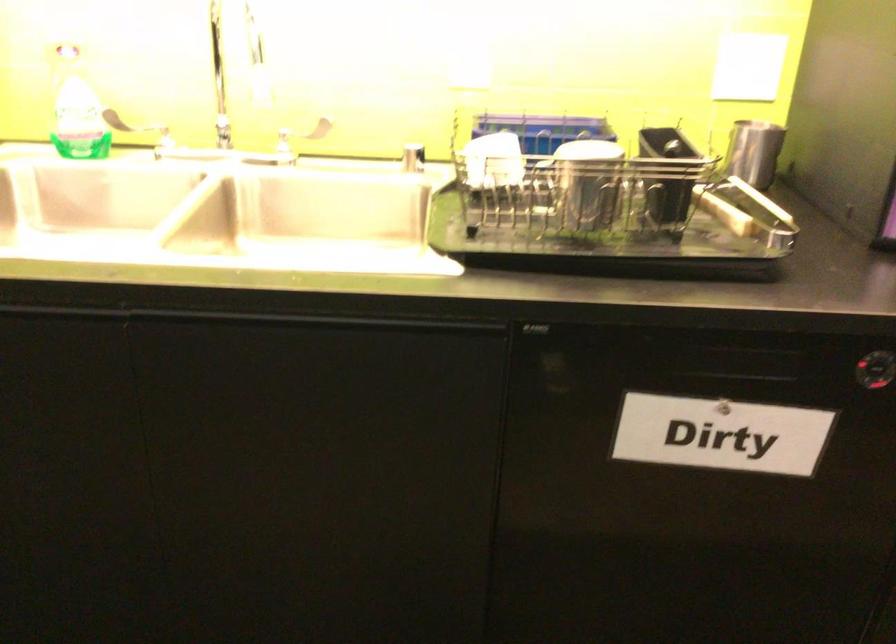
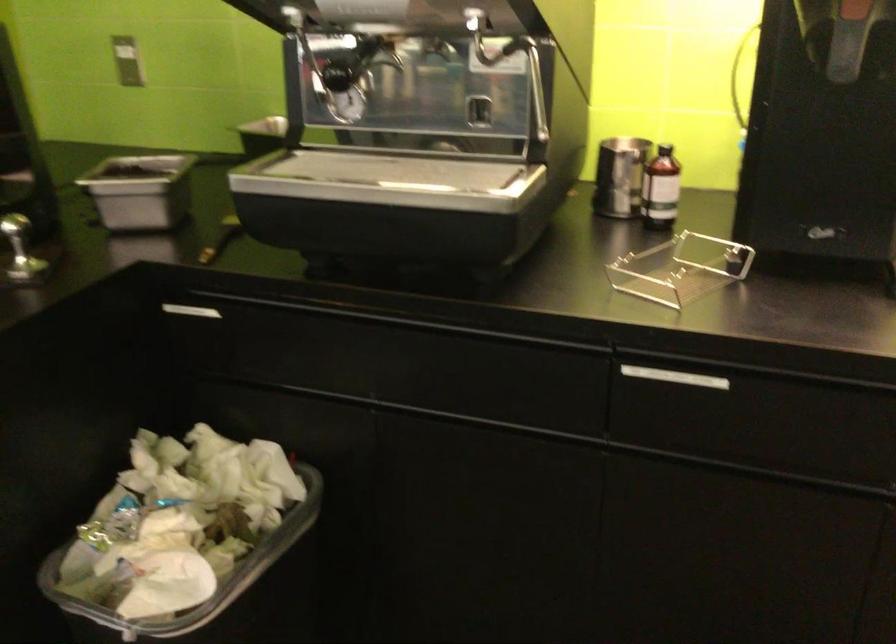
Question: In a continuous first-person perspective shot, in which direction is the camera moving?

Choices:
 (A) Left
 (B) Right
 (C) Forward
 (D) Backward

Answer: (A)